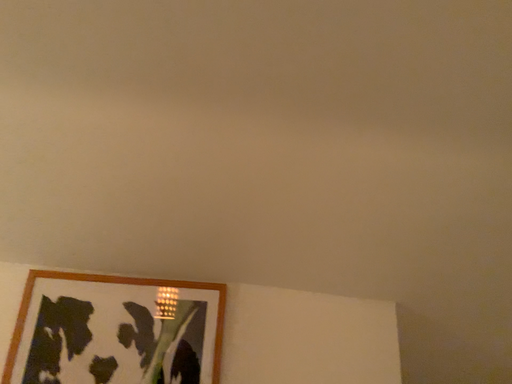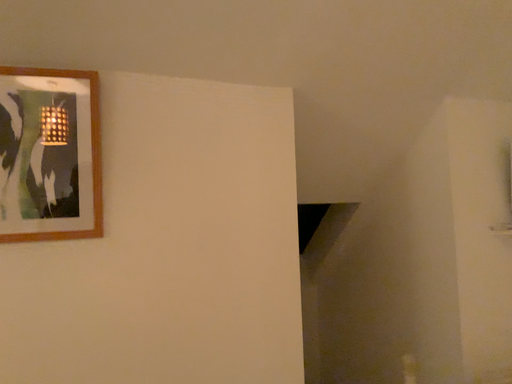
Question: Which way did the camera rotate in the video?

Choices:
 (A) rotated left
 (B) rotated right

Answer: (B)